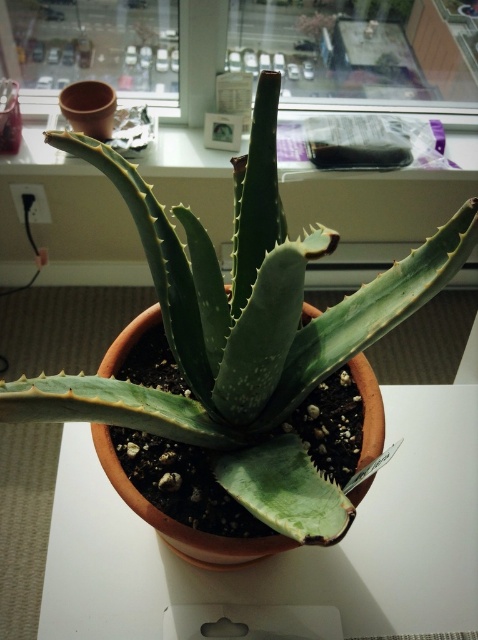
You are organizing a small plant display and need to place the potted aloe vera plant on either the white matte table at center or the green matte window sill at upper center. Based on their sizes, which surface can accommodate the plant more comfortably?

The green matte window sill at upper center has a larger size compared to the white matte table at center, so it can accommodate the potted aloe vera plant more comfortably.

You are organizing items on the desk and need to place both the green matte window sill at upper center and the transparent plastic bag at upper center. Since you want to use the space efficiently, which item should you place first to maximize the available space?

The green matte window sill at upper center is larger in size than the transparent plastic bag at upper center, so you should place the green matte window sill at upper center first to make better use of the available space.